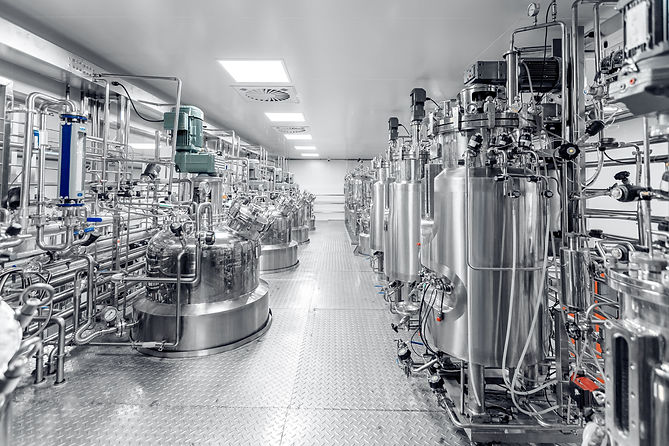
The height and width of the screenshot is (446, 669). Find the location of `ceiling lights`. ceiling lights is located at coordinates (267, 68), (292, 119), (300, 138), (308, 146), (312, 156).